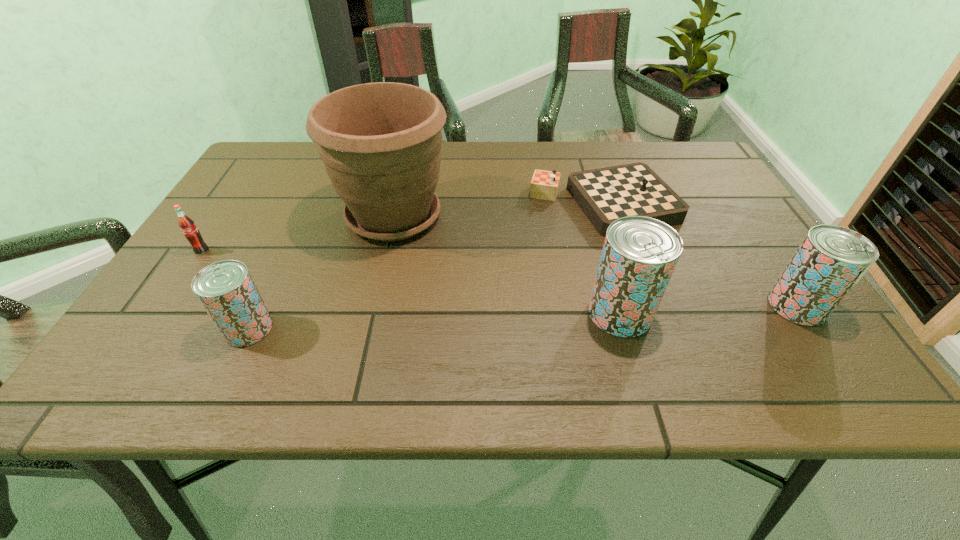
Where is `free space that satisfies the following two spatial constraints: 1. on the label of the shortest beer can; 2. on the left side of the soda bottle`? This screenshot has width=960, height=540. free space that satisfies the following two spatial constraints: 1. on the label of the shortest beer can; 2. on the left side of the soda bottle is located at coordinates (150, 328).

At what (x,y) coordinates should I click in order to perform the action: click on vacant point that satisfies the following two spatial constraints: 1. on the back side of the shortest object; 2. on the right side of the tallest object. Please return your answer as a coordinate pair (x, y). The width and height of the screenshot is (960, 540). Looking at the image, I should click on (396, 204).